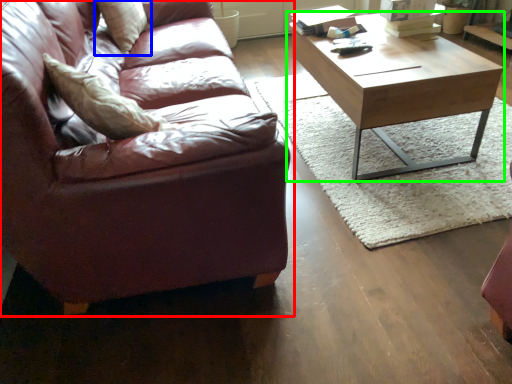
Question: Which is farther away from studio couch (highlighted by a red box)? pillow (highlighted by a blue box) or coffee table (highlighted by a green box)?

Choices:
 (A) pillow
 (B) coffee table

Answer: (B)